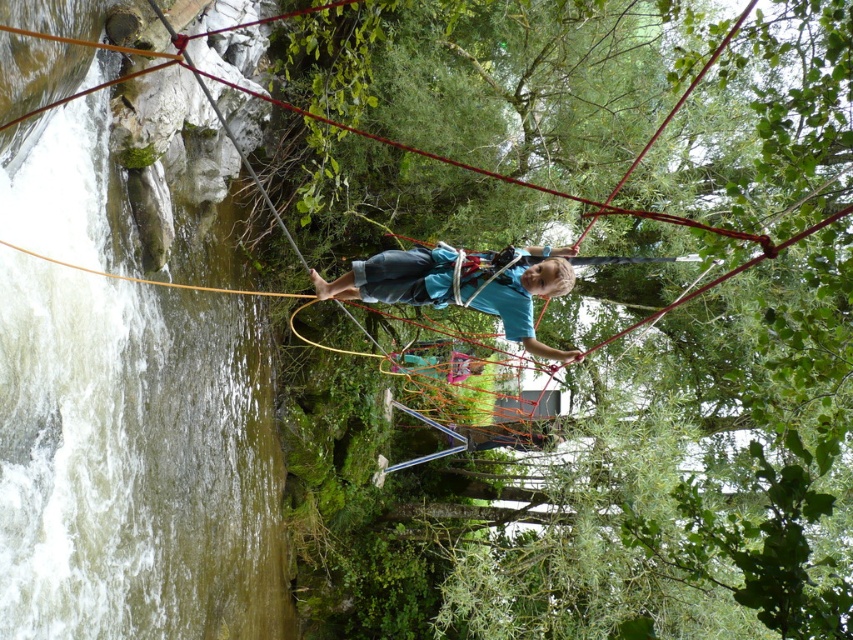
Who is more distant from viewer, (816, 394) or (410, 276)?

Positioned behind is point (816, 394).

Is point (154, 64) positioned in front of point (548, 278)?

That is False.

Which is in front, point (10, 310) or point (397, 294)?

Positioned in front is point (397, 294).

I want to click on rope bridge at center, so click(529, 90).

Locate an element on the screen. blue fabric shirt at center is located at coordinates (393, 276).

Can you confirm if blue fabric shirt at center is positioned above blue fabric at center?

Correct, blue fabric shirt at center is located above blue fabric at center.

Between point (341, 294) and point (451, 387), which one is positioned behind?

The point (451, 387) is more distant.

Where is `blue fabric shirt at center`? This screenshot has height=640, width=853. blue fabric shirt at center is located at coordinates (393, 276).

In order to click on rope bridge at center in this screenshot , I will do `click(529, 90)`.